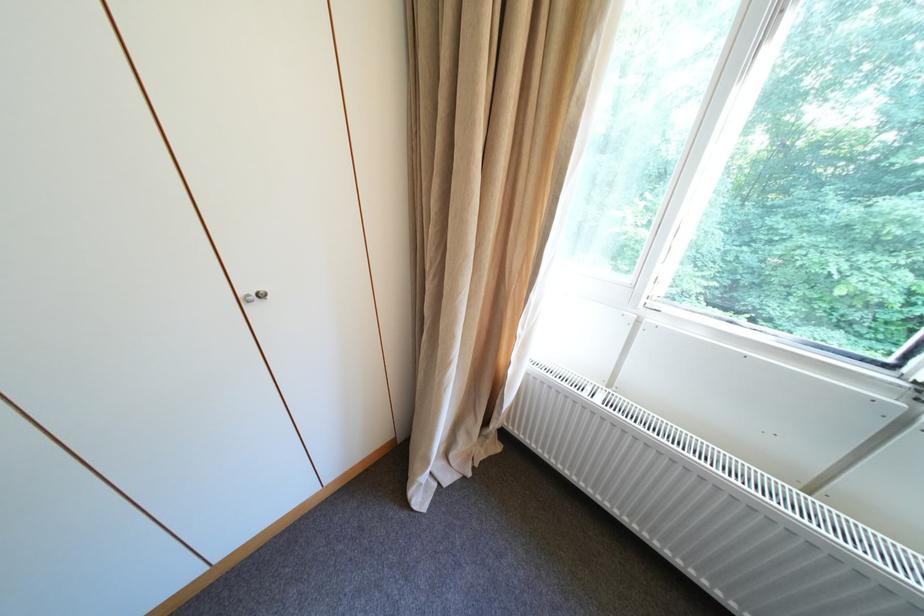
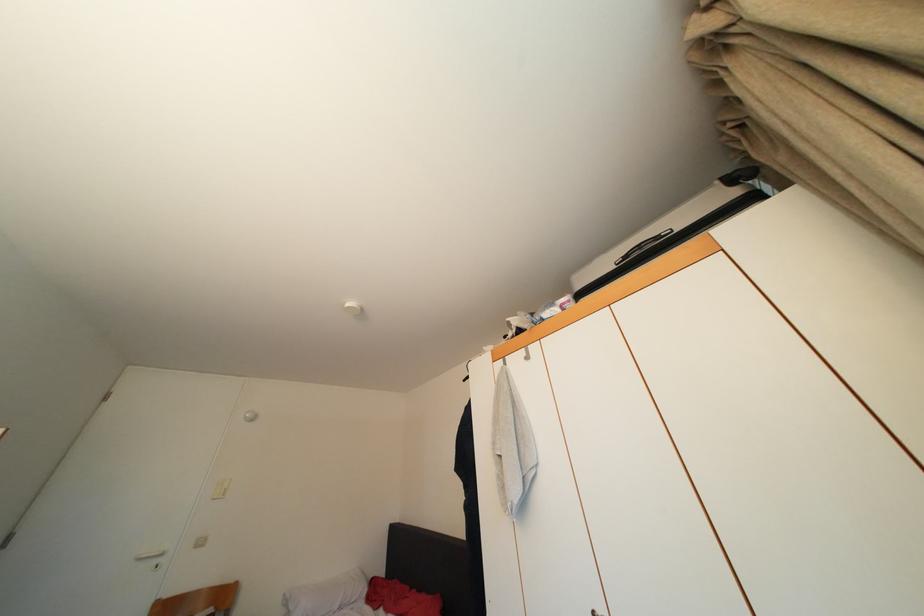
The first image is from the beginning of the video and the second image is from the end. How did the camera likely rotate when shooting the video?

The camera rotated toward left-up.